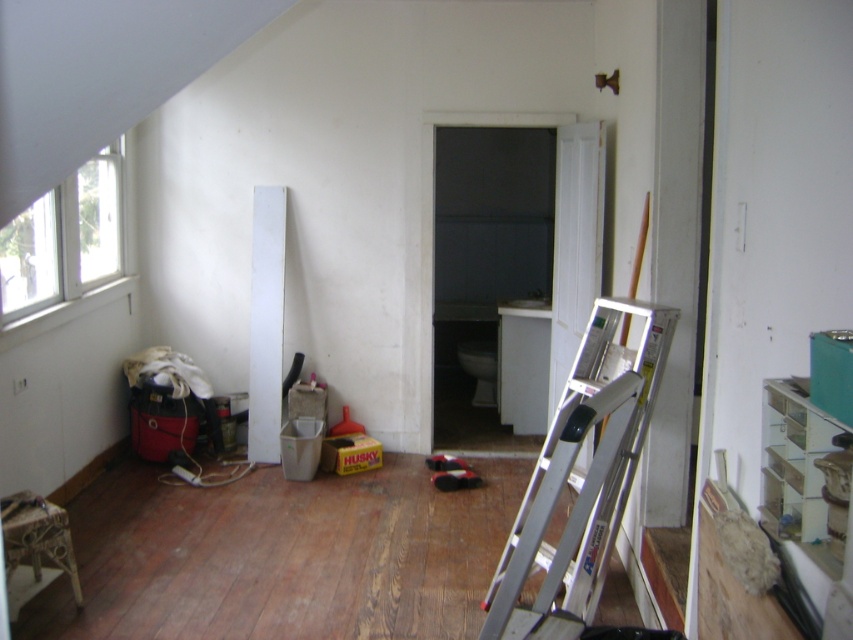
Can you confirm if silver metallic ladder at lower right is wider than white plastic window at upper left?

Indeed, silver metallic ladder at lower right has a greater width compared to white plastic window at upper left.

Between silver metallic ladder at lower right and white plastic window at upper left, which one has less height?

With less height is white plastic window at upper left.

Image resolution: width=853 pixels, height=640 pixels. In order to click on silver metallic ladder at lower right in this screenshot , I will do `click(581, 477)`.

You are a GUI agent. You are given a task and a screenshot of the screen. Output one action in this format:
    pyautogui.click(x=<x>, y=<y>)
    Task: Click on the silver metallic ladder at lower right
    
    Given the screenshot: What is the action you would take?
    pyautogui.click(x=581, y=477)